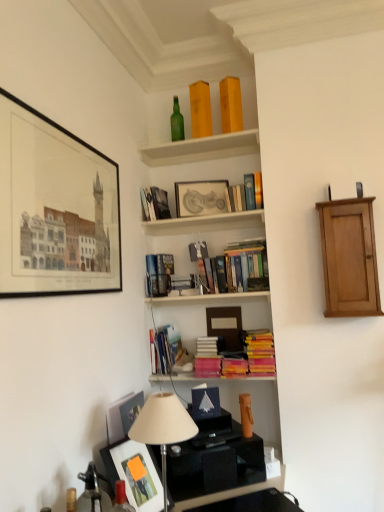
Locate an element on the screen. This screenshot has width=384, height=512. free space to the back side of matte silver picture frame at center, acting as the first picture frame starting from the right is located at coordinates (200, 222).